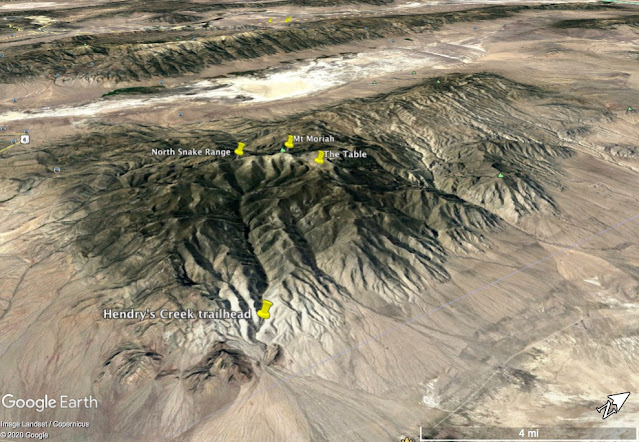
The width and height of the screenshot is (639, 442). I want to click on yellow push pin, so click(261, 305), click(240, 149), click(288, 145), click(318, 158).